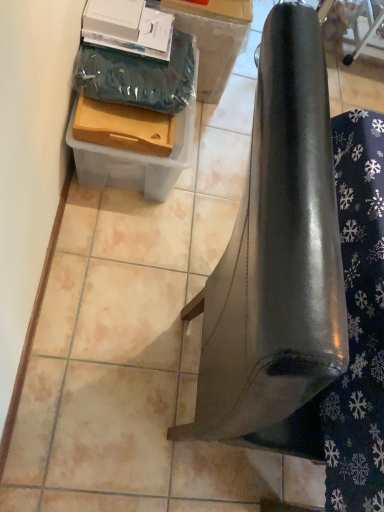
I want to click on vacant space that is in between glossy metallic punching bag at right and matte plastic box at upper left, the second cardboard box viewed from the top, so click(156, 248).